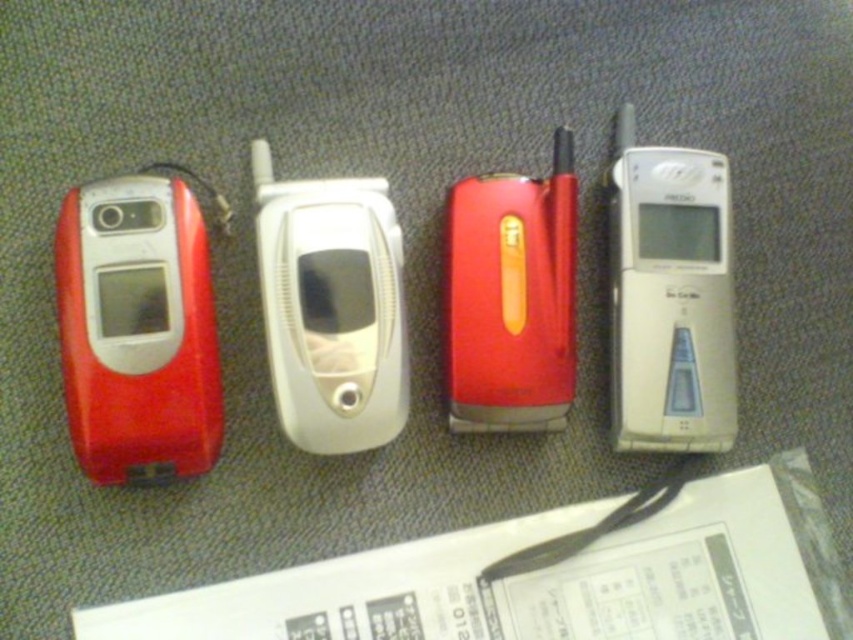
Question: Does matte red phone at left come behind red matte flip phone at center?

Choices:
 (A) yes
 (B) no

Answer: (B)

Question: Which object is closer to the camera taking this photo?

Choices:
 (A) white glossy flip phone at center
 (B) matte red phone at left
 (C) red matte flip phone at center

Answer: (B)

Question: Which of these objects is positioned farthest from the matte red phone at left?

Choices:
 (A) white glossy flip phone at center
 (B) red matte flip phone at center

Answer: (B)

Question: Can you confirm if white glossy flip phone at center is smaller than red matte flip phone at center?

Choices:
 (A) no
 (B) yes

Answer: (A)

Question: Considering the relative positions of white glossy flip phone at center and red matte flip phone at center in the image provided, where is white glossy flip phone at center located with respect to red matte flip phone at center?

Choices:
 (A) above
 (B) below

Answer: (B)

Question: Which object is the farthest from the silver metallic phone at right?

Choices:
 (A) white glossy flip phone at center
 (B) red matte flip phone at center

Answer: (A)